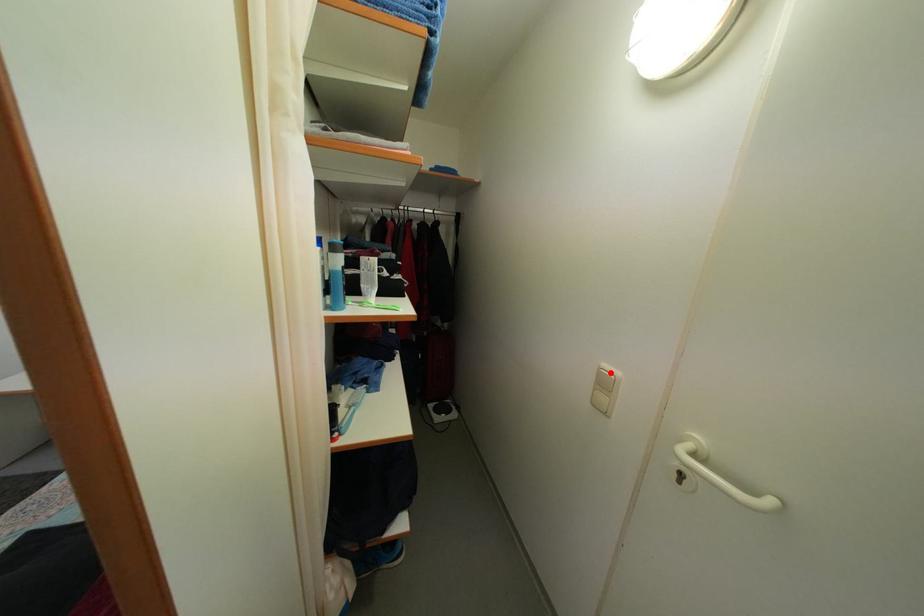
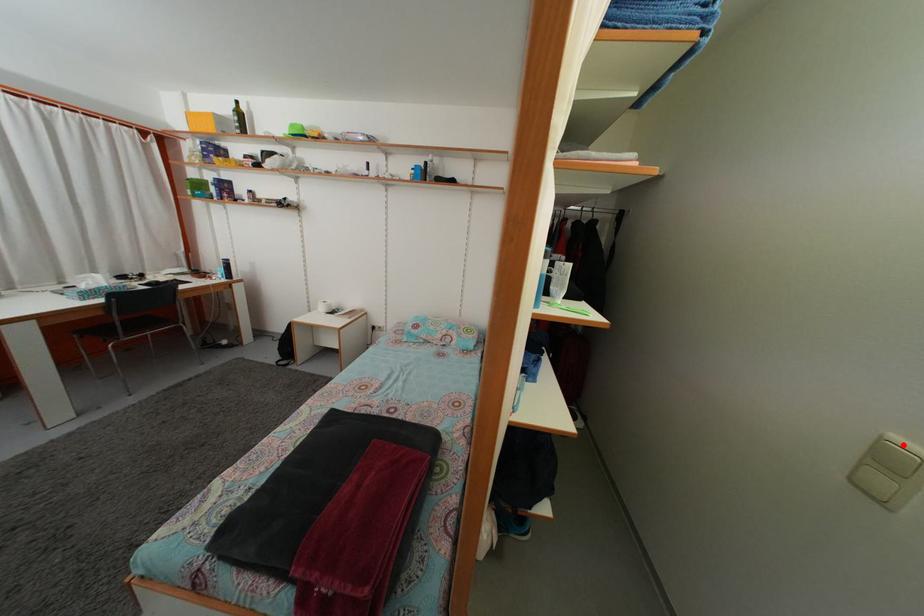
From the picture: I am providing you with two images of the same scene from different viewpoints. A red point is marked on the first image and another point is marked on the second image. Is the marked point in image1 the same physical position as the marked point in image2?

Yes